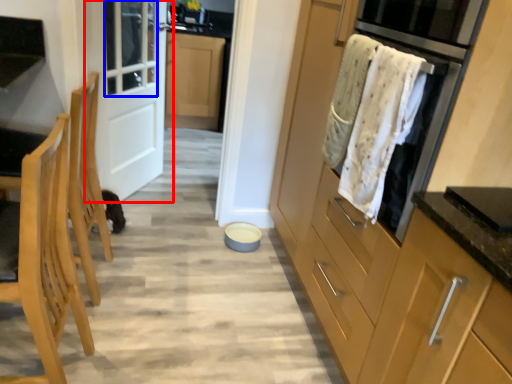
Question: Which object appears farthest to the camera in this image, door (highlighted by a red box) or window (highlighted by a blue box)?

Choices:
 (A) door
 (B) window

Answer: (B)